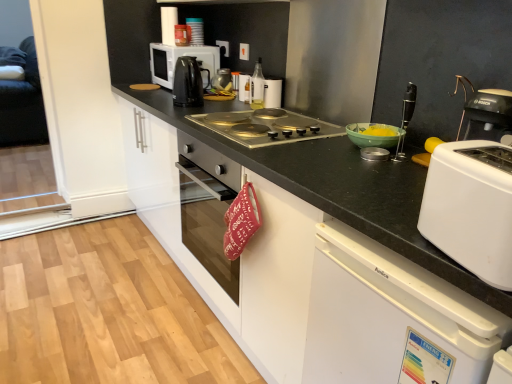
Where is `empty space that is ontop of white matte cabinet at center, which ranks as the 2th cabinetry in front-to-back order (from a real-world perspective)`? empty space that is ontop of white matte cabinet at center, which ranks as the 2th cabinetry in front-to-back order (from a real-world perspective) is located at coordinates (260, 110).